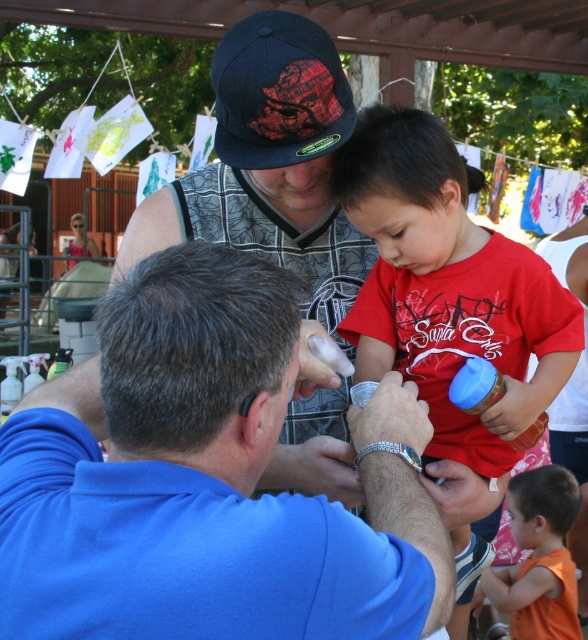
Question: Does matte red shirt at center have a lesser width compared to orange cotton shirt at lower right?

Choices:
 (A) no
 (B) yes

Answer: (A)

Question: Which point is farther to the camera?

Choices:
 (A) [330, 90]
 (B) [355, 337]

Answer: (B)

Question: Which point is closer to the camera taking this photo?

Choices:
 (A) (526, 488)
 (B) (220, 392)
 (C) (325, 96)
 (D) (295, 45)

Answer: (B)

Question: Is matte red shirt at center above matte black cap at upper center?

Choices:
 (A) yes
 (B) no

Answer: (B)

Question: Does black matte baseball cap at upper center have a larger size compared to orange cotton shirt at lower right?

Choices:
 (A) yes
 (B) no

Answer: (B)

Question: Among these objects, which one is nearest to the camera?

Choices:
 (A) orange cotton shirt at lower right
 (B) matte black cap at upper center

Answer: (B)